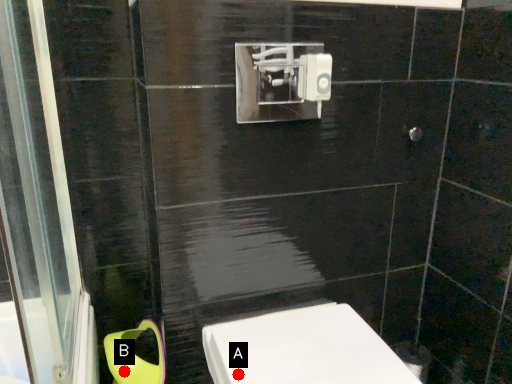
Question: Two points are circled on the image, labeled by A and B beside each circle. Which point is closer to the camera taking this photo?

Choices:
 (A) A is closer
 (B) B is closer

Answer: (A)